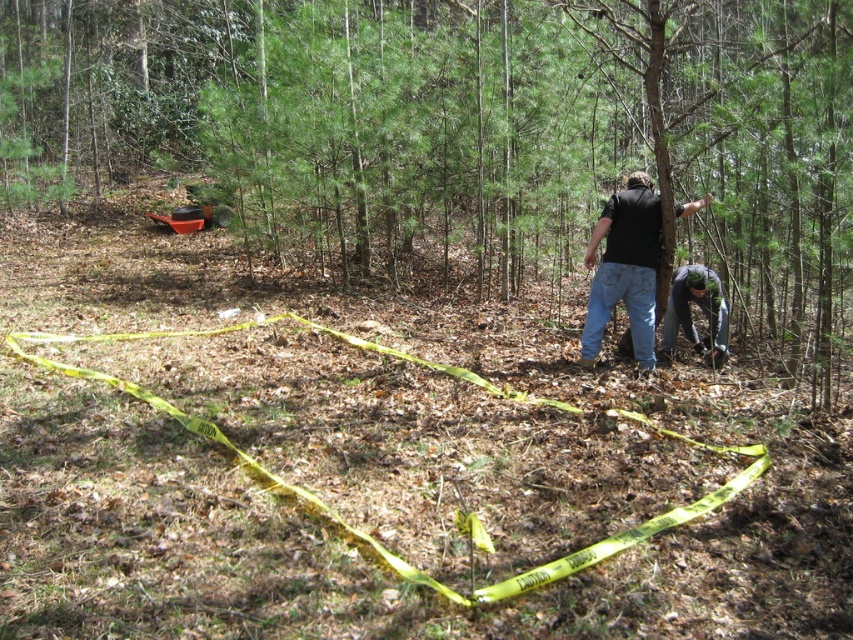
Who is more forward, (624,212) or (709,273)?

Point (624,212) is in front.

Measure the distance between point (643, 362) and camera.

Point (643, 362) and camera are 6.73 meters apart.

At what (x,y) coordinates should I click in order to perform the action: click on black matte shirt at center. Please return your answer as a coordinate pair (x, y). Looking at the image, I should click on (624, 268).

Does green textured tree at center have a greater width compared to black matte shirt at center?

Indeed, green textured tree at center has a greater width compared to black matte shirt at center.

Can you confirm if green textured tree at center is positioned above black matte shirt at center?

Indeed, green textured tree at center is positioned over black matte shirt at center.

Which is behind, point (447, 122) or point (637, 324)?

Point (447, 122)

This screenshot has height=640, width=853. I want to click on green textured tree at center, so click(466, 131).

Which of these two, green textured tree at center or dark gray fabric at lower right, stands shorter?

With less height is dark gray fabric at lower right.

Is green textured tree at center smaller than dark gray fabric at lower right?

No.

Between point (343, 140) and point (706, 337), which one is positioned behind?

The point (343, 140) is more distant.

Where is `green textured tree at center`? green textured tree at center is located at coordinates pyautogui.click(x=466, y=131).